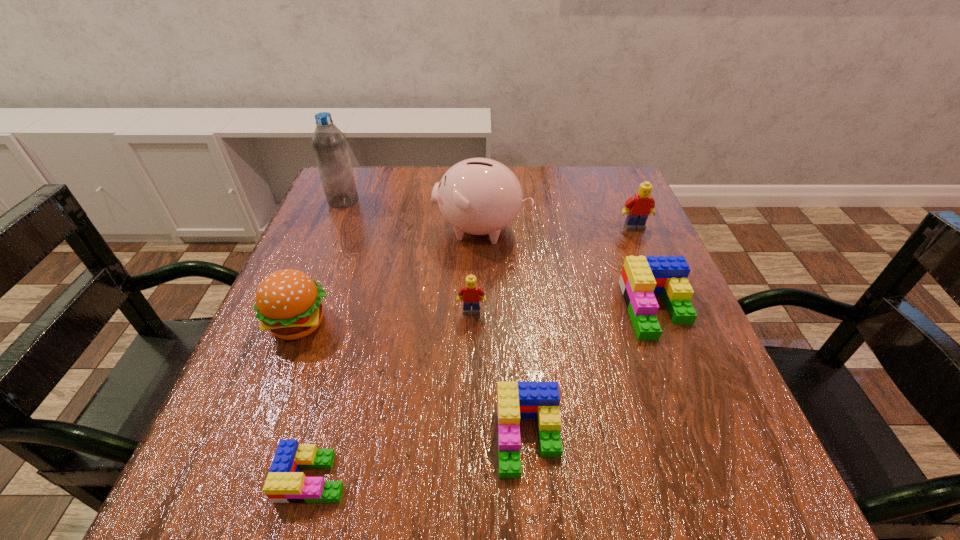
Identify the location of water bottle. The image size is (960, 540). (329, 144).

Where is `the tallest object`? Image resolution: width=960 pixels, height=540 pixels. the tallest object is located at coordinates pos(329,144).

Identify the location of the seventh shortest object. 479,196.

At what (x,y) coordinates should I click in order to perform the action: click on pink piggy bank. Please return your answer as a coordinate pair (x, y). This screenshot has height=540, width=960. Looking at the image, I should click on (479, 196).

This screenshot has width=960, height=540. I want to click on the bigger yellow Lego, so click(637, 208).

You are a GUI agent. You are given a task and a screenshot of the screen. Output one action in this format:
    pyautogui.click(x=<x>, y=<y>)
    Task: Click on the farther yellow Lego
    The width and height of the screenshot is (960, 540).
    Given the screenshot: What is the action you would take?
    pyautogui.click(x=637, y=208)

You are a GUI agent. You are given a task and a screenshot of the screen. Output one action in this format:
    pyautogui.click(x=<x>, y=<y>)
    Task: Click on the hamburger
    The height and width of the screenshot is (540, 960).
    Given the screenshot: What is the action you would take?
    pyautogui.click(x=288, y=302)

I want to click on the smaller yellow Lego, so click(x=470, y=294).

Where is `the second Lego from left to right`? This screenshot has height=540, width=960. the second Lego from left to right is located at coordinates (470, 294).

The image size is (960, 540). What are the coordinates of `the third shortest Lego` in the screenshot? It's located at [642, 278].